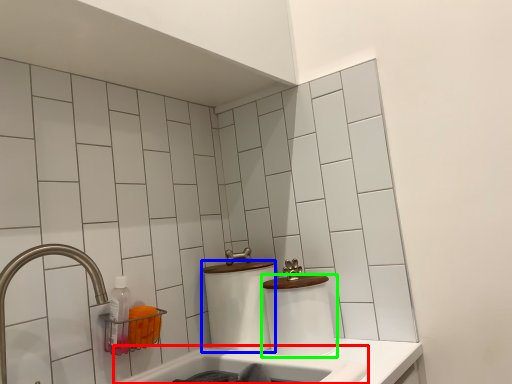
Question: Which object is positioned farthest from bath (highlighted by a red box)? Select from toilet paper (highlighted by a blue box) and toilet paper (highlighted by a green box).

Choices:
 (A) toilet paper
 (B) toilet paper

Answer: (A)